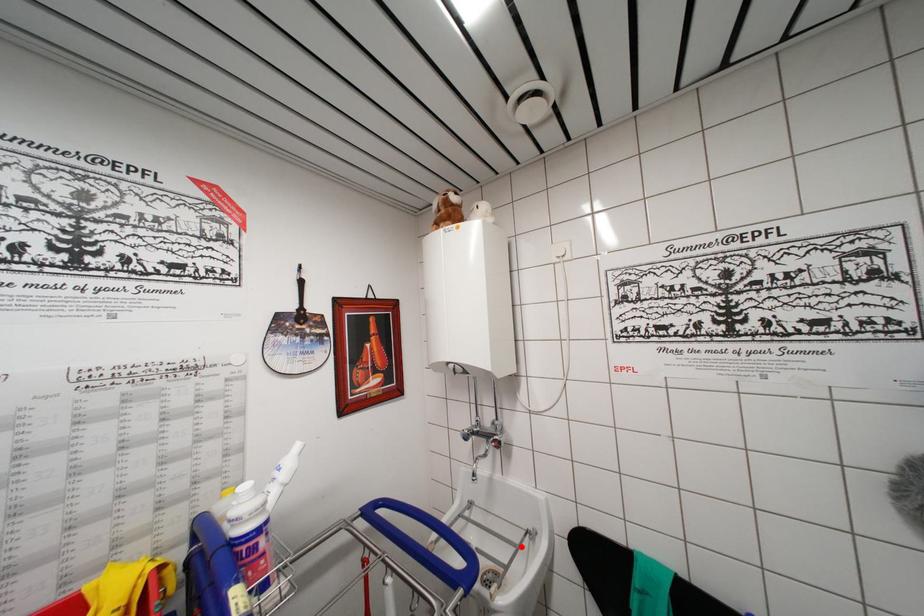
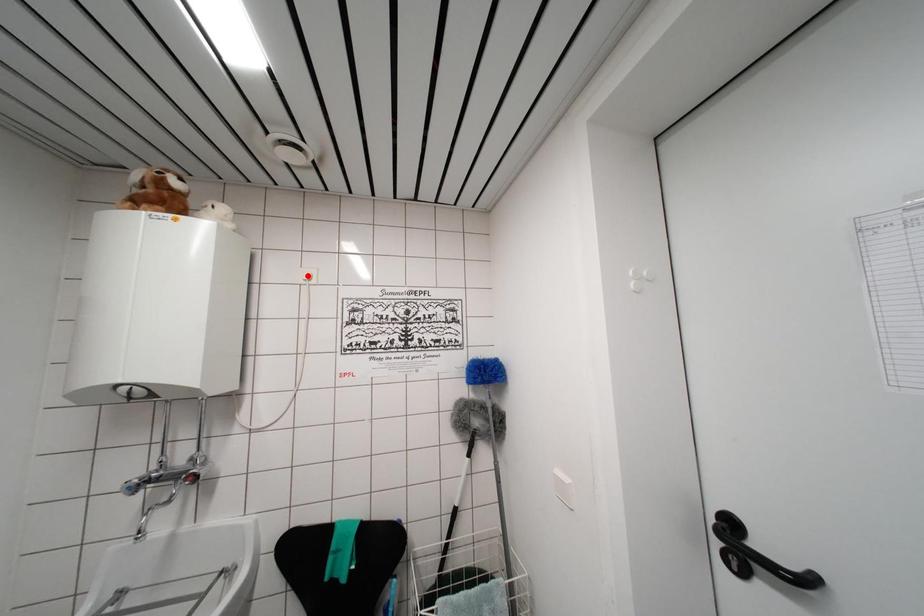
I am providing you with two images of the same scene from different viewpoints. A red point is marked on the first image and another point is marked on the second image. Are the points marked in image1 and image2 representing the same 3D position?

No